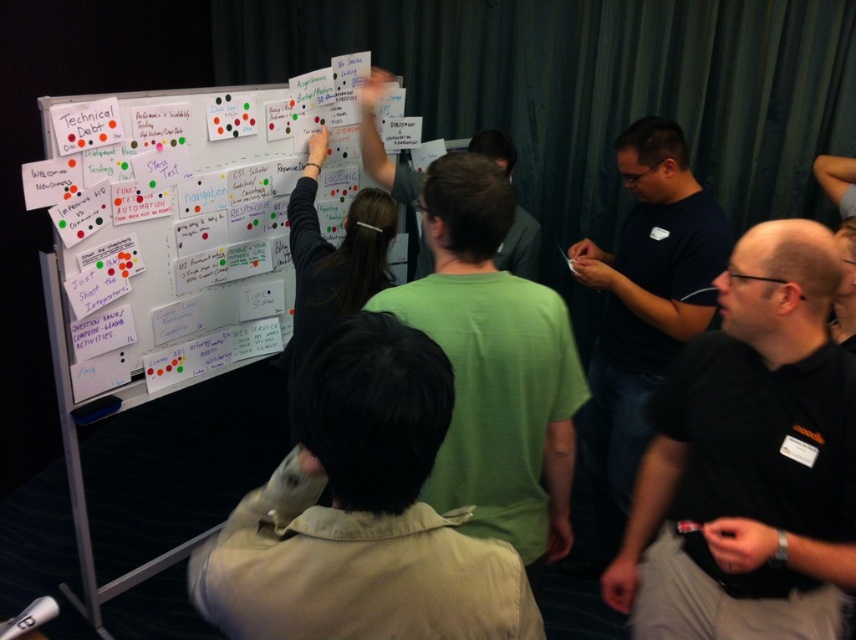
What is located at the coordinate point (183, 237) in the image?

The white paperboard at upper left is located at point (183, 237).

You are standing in the workshop and need to reach the white paperboard at upper left to add a note. If your arm can extend 1.8 meters, can you reach it without moving closer?

The white paperboard at upper left is 1.94 meters away from the viewer. Since your arm can only extend 1.8 meters, you cannot reach it without moving closer.

You are a participant in the meeting and want to pass a note to the person wearing the green matte shirt at upper center without getting up from your seat. The note is on the white paperboard at upper left. Can you reach them by sliding the note across the table? Explain your reasoning.

The distance between the white paperboard at upper left and the green matte shirt at upper center is 38.14 inches. Since sliding a note across a table typically requires the distance to be within arm reach, and assuming an average arm reach of about 30 inches, the distance is too far to slide the note without getting up.